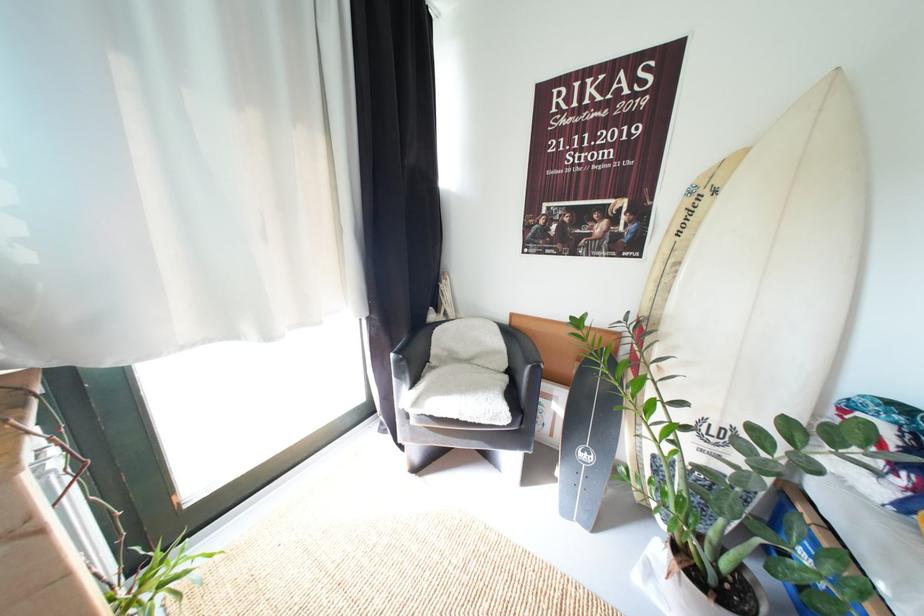
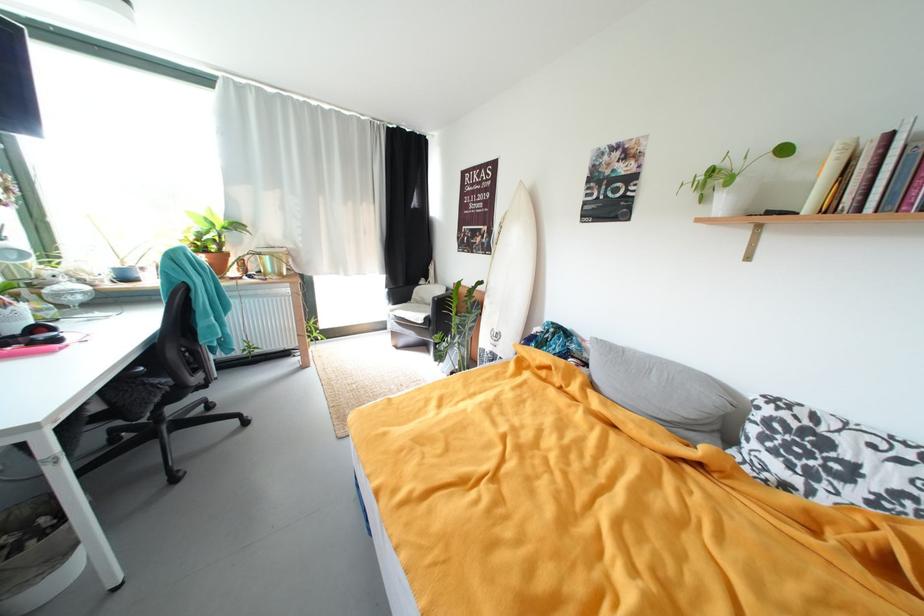
Where in the second image is the point corresponding to the point at 423,405 from the first image?

(399, 313)